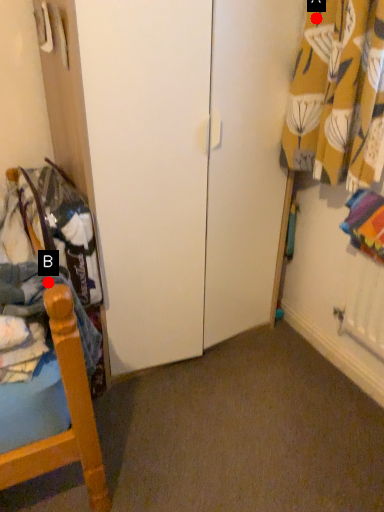
Question: Two points are circled on the image, labeled by A and B beside each circle. Among these points, which one is nearest to the camera?

Choices:
 (A) A is closer
 (B) B is closer

Answer: (B)